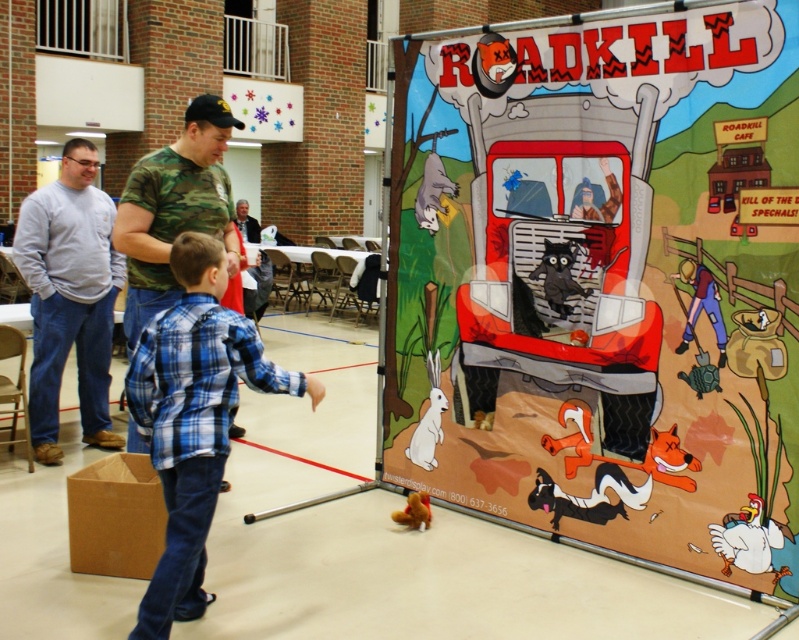
Is blue plaid shirt at center to the left of gray cotton sweatshirt at left from the viewer's perspective?

Incorrect, blue plaid shirt at center is not on the left side of gray cotton sweatshirt at left.

Who is shorter, blue plaid shirt at center or gray cotton sweatshirt at left?

Standing shorter between the two is blue plaid shirt at center.

Does point (229, 320) come in front of point (54, 406)?

Yes, point (229, 320) is in front of point (54, 406).

Identify the location of blue plaid shirt at center. The width and height of the screenshot is (799, 640). pos(193,419).

Which is behind, point (436, 177) or point (398, 513)?

The point (436, 177) is behind.

Find the location of a particular element. The image size is (799, 640). cartoonish paper truck at center is located at coordinates (601, 280).

Does gray cotton sweatshirt at left appear over camo fabric shirt at center?

Actually, gray cotton sweatshirt at left is below camo fabric shirt at center.

Based on the photo, who is more forward, (100, 280) or (205, 134)?

Point (205, 134)

Which is behind, point (44, 410) or point (237, 275)?

The point (44, 410) is behind.

Identify the location of gray cotton sweatshirt at left. coord(70,296).